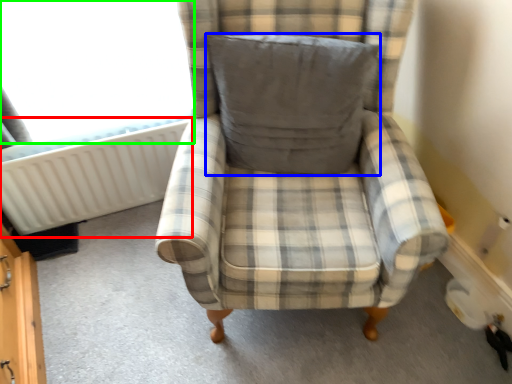
Question: Which object is the farthest from radiator (highlighted by a red box)? Choose among these: pillow (highlighted by a blue box) or window screen (highlighted by a green box).

Choices:
 (A) pillow
 (B) window screen

Answer: (A)